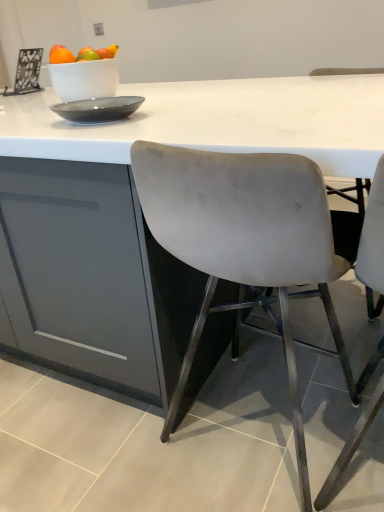
Question: Can you confirm if white marble table at center is shorter than matte gray chair at right, positioned as the second chair in left-to-right order?

Choices:
 (A) yes
 (B) no

Answer: (B)

Question: Can you confirm if white marble table at center is taller than matte gray chair at right, which appears as the first chair when viewed from the right?

Choices:
 (A) yes
 (B) no

Answer: (A)

Question: Can you confirm if white marble table at center is wider than matte gray chair at right, positioned as the second chair in left-to-right order?

Choices:
 (A) no
 (B) yes

Answer: (B)

Question: Could you tell me if white marble table at center is turned towards matte gray chair at right, which appears as the first chair when viewed from the right?

Choices:
 (A) no
 (B) yes

Answer: (B)

Question: Is matte gray chair at right, positioned as the second chair in left-to-right order, at the back of white marble table at center?

Choices:
 (A) no
 (B) yes

Answer: (A)

Question: From a real-world perspective, is white marble table at center positioned over matte gray chair at right, which appears as the first chair when viewed from the right, based on gravity?

Choices:
 (A) no
 (B) yes

Answer: (A)

Question: Are satin grey chair at center, placed as the second chair when sorted from right to left, and matte gray chair at right, which appears as the first chair when viewed from the right, making contact?

Choices:
 (A) yes
 (B) no

Answer: (B)

Question: Is the position of satin grey chair at center, which is the 1th chair in left-to-right order, less distant than that of matte gray chair at right, positioned as the second chair in left-to-right order?

Choices:
 (A) yes
 (B) no

Answer: (B)

Question: Is satin grey chair at center, which is the 1th chair in left-to-right order, shorter than matte gray chair at right, which appears as the first chair when viewed from the right?

Choices:
 (A) no
 (B) yes

Answer: (B)

Question: Does satin grey chair at center, which is the 1th chair in left-to-right order, have a greater height compared to matte gray chair at right, positioned as the second chair in left-to-right order?

Choices:
 (A) yes
 (B) no

Answer: (B)

Question: Can you confirm if satin grey chair at center, which is the 1th chair in left-to-right order, is thinner than matte gray chair at right, positioned as the second chair in left-to-right order?

Choices:
 (A) no
 (B) yes

Answer: (B)

Question: Is satin grey chair at center, which is the 1th chair in left-to-right order, oriented away from matte gray chair at right, which appears as the first chair when viewed from the right?

Choices:
 (A) yes
 (B) no

Answer: (B)

Question: From a real-world perspective, is satin grey chair at center, which is the 1th chair in left-to-right order, located beneath white marble table at center?

Choices:
 (A) yes
 (B) no

Answer: (B)